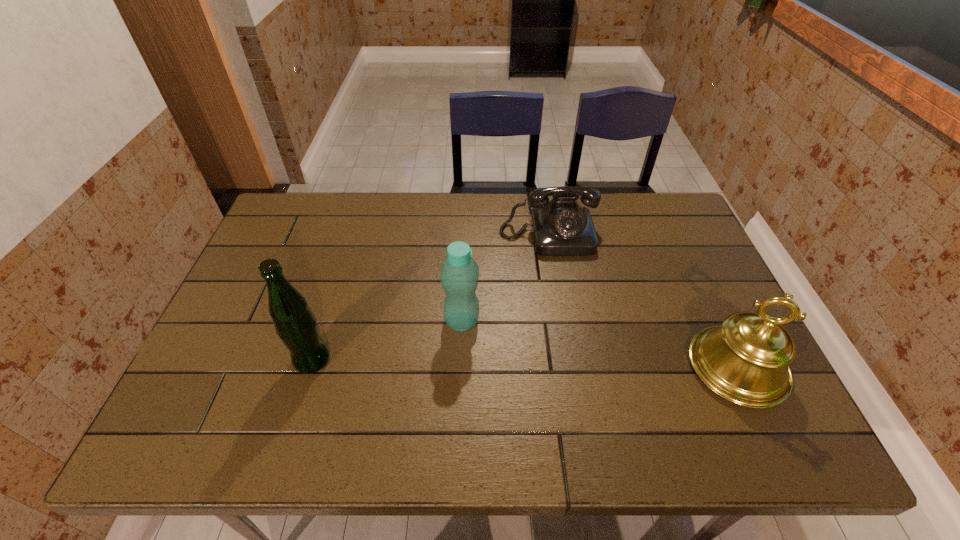
This screenshot has width=960, height=540. Identify the location of free space on the desktop that is between the beer bottle and the bell and is positioned on the dial of the shortest object. (572, 364).

You are a GUI agent. You are given a task and a screenshot of the screen. Output one action in this format:
    pyautogui.click(x=<x>, y=<y>)
    Task: Click on the free space on the desktop that is between the beer bottle and the bell and is positioned at the front cap of the third object from right to left
    
    Given the screenshot: What is the action you would take?
    pyautogui.click(x=539, y=363)